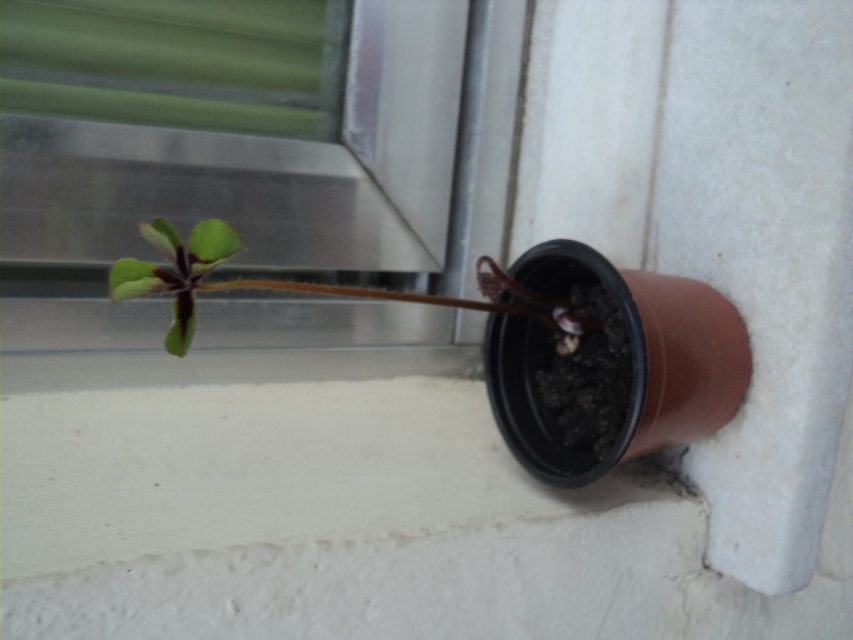
Question: Is green matte window at upper left positioned in front of green matte leaf at center?

Choices:
 (A) yes
 (B) no

Answer: (B)

Question: Is green matte window at upper left closer to the viewer compared to green matte leaf at center?

Choices:
 (A) no
 (B) yes

Answer: (A)

Question: Is green matte window at upper left to the right of green matte leaf at center from the viewer's perspective?

Choices:
 (A) no
 (B) yes

Answer: (A)

Question: Among these points, which one is farthest from the camera?

Choices:
 (A) (341, 129)
 (B) (500, 301)

Answer: (A)

Question: Which object appears closest to the camera in this image?

Choices:
 (A) green matte window at upper left
 (B) green matte leaf at center

Answer: (B)